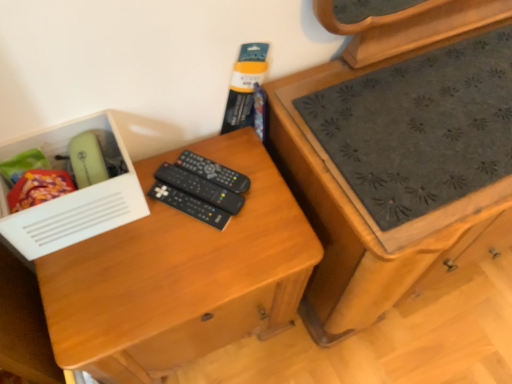
You are a GUI agent. You are given a task and a screenshot of the screen. Output one action in this format:
    pyautogui.click(x=<x>, y=<y>)
    Task: Click on the free space above wooden desk at center (from a real-world perspective)
    This screenshot has height=384, width=512.
    Given the screenshot: What is the action you would take?
    pyautogui.click(x=177, y=234)